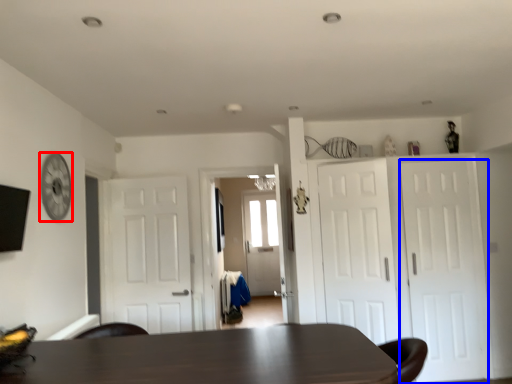
Question: Which object appears closest to the camera in this image, clock (highlighted by a red box) or door (highlighted by a blue box)?

Choices:
 (A) clock
 (B) door

Answer: (A)